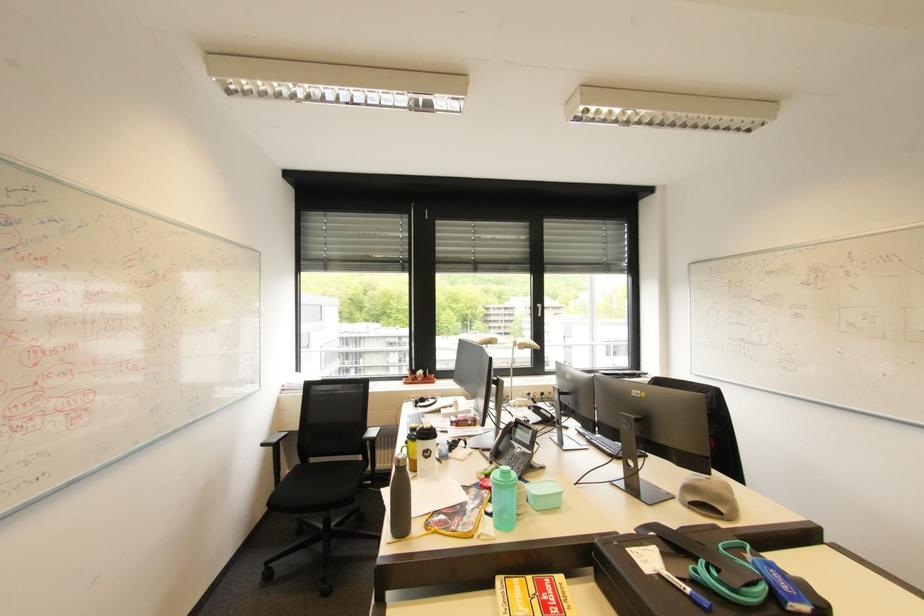
Find where to open the yellow book. Please return your answer as a coordinate pair (x, y).

(533, 594)